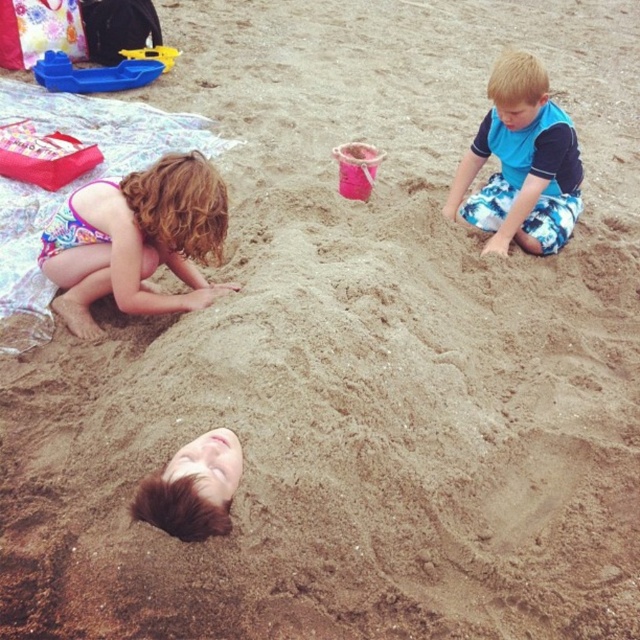
You are standing at the camera position and want to hand the multicolored swimsuit at lower left to a friend who is 5 feet tall. Can they comfortably reach it from where you are holding it?

The multicolored swimsuit at lower left and camera are 9.45 feet apart. Since the friend is 5 feet tall, they would need to stretch or jump to reach the swimsuit if it is held at your height, which is likely around 5 feet or higher. However, the exact reachability depends on the height of the person holding the swimsuit. Without knowing your height, it is hard to determine.

You are a lifeguard observing the beach scene. You notice a point at coordinates (136, 241). Based on the scene description, what object is located at that point?

The point at coordinates (136, 241) corresponds to the multicolored swimsuit at lower left.